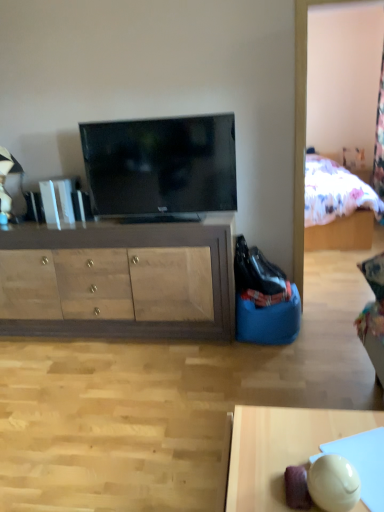
The width and height of the screenshot is (384, 512). Identify the location of unoccupied area in front of wooden cabinet at center. (108, 396).